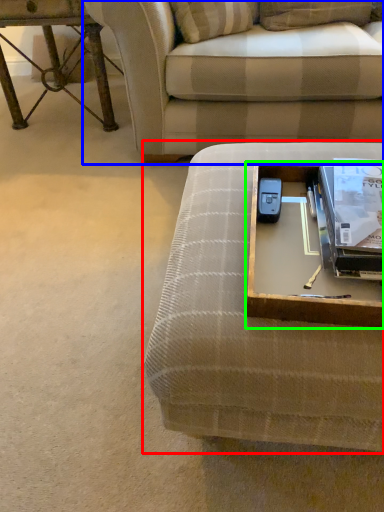
Question: Considering the real-world distances, which object is closest to studio couch (highlighted by a red box)? studio couch (highlighted by a blue box) or round table (highlighted by a green box).

Choices:
 (A) studio couch
 (B) round table

Answer: (B)